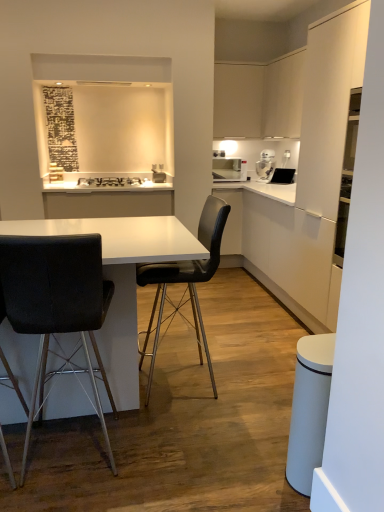
Identify the location of empty space that is to the right of black leather chair at left, the 1th chair when ordered from left to right. (167, 449).